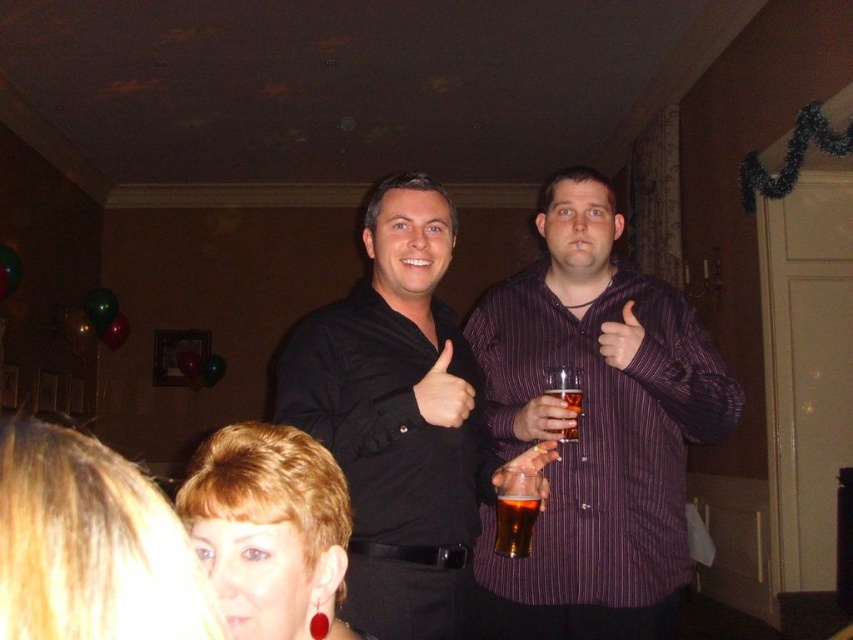
You are standing in the center of the room and want to greet the person with blonde hair at lower left. In which direction should you move to reach them?

The person with blonde hair at lower left is located at point 0.852 on the x and 0.107 on the y axis, so you should move towards the lower left direction to reach them.

You are a photographer at the party and want to take a photo of the blonde hair at lower left and the translucent plastic cup at center. To ensure both are in frame, which object should you position closer to the camera?

You should position the blonde hair at lower left closer to the camera because it is to the left of the translucent plastic cup at center, so moving it forward would help both fit in the frame.